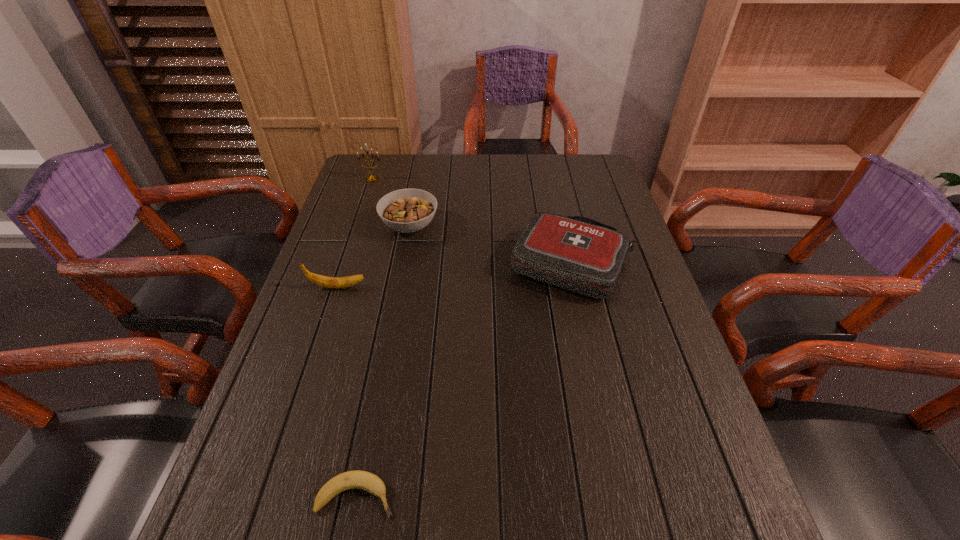
At what (x,y) coordinates should I click in order to perform the action: click on the tallest object. Please return your answer as a coordinate pair (x, y). Looking at the image, I should click on (373, 178).

You are a GUI agent. You are given a task and a screenshot of the screen. Output one action in this format:
    pyautogui.click(x=<x>, y=<y>)
    Task: Click on the candelabrum
    Image resolution: width=960 pixels, height=540 pixels.
    Given the screenshot: What is the action you would take?
    pyautogui.click(x=373, y=178)

Where is `the first-aid kit`? the first-aid kit is located at coordinates (577, 253).

Where is `the farther banana`? The image size is (960, 540). the farther banana is located at coordinates (329, 282).

Image resolution: width=960 pixels, height=540 pixels. Identify the location of the left banana. (329, 282).

Where is `stew`? stew is located at coordinates (409, 210).

At what (x,y) coordinates should I click in order to perform the action: click on the nearer banana. Please return your answer as a coordinate pair (x, y). Image resolution: width=960 pixels, height=540 pixels. Looking at the image, I should click on (357, 479).

In order to click on the nearest object in this screenshot , I will do `click(357, 479)`.

Find the location of a particular element. The width and height of the screenshot is (960, 540). vacant position located 0.150m on the back of the tallest object is located at coordinates (380, 155).

The height and width of the screenshot is (540, 960). Find the location of `free space located on the left of the rightmost object`. free space located on the left of the rightmost object is located at coordinates coord(378,264).